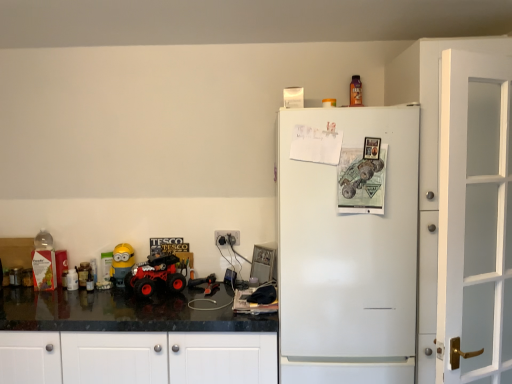
Question: From a real-world perspective, is rubberized red monster truck at lower left physically located above or below white glass door at right?

Choices:
 (A) above
 (B) below

Answer: (B)

Question: In terms of height, does rubberized red monster truck at lower left look taller or shorter compared to white glass door at right?

Choices:
 (A) tall
 (B) short

Answer: (B)

Question: Estimate the real-world distances between objects in this image. Which object is closer to the yellow matte minion at left, arranged as the 2th toy when viewed from the right?

Choices:
 (A) white plastic electric outlet at center
 (B) rubberized red monster truck at lower left
 (C) white matte refrigerator at right
 (D) metallic orange bottle at upper center, which is the 3th toy in bottom-to-top order
 (E) black granite countertop at lower left

Answer: (B)

Question: Which object is positioned farthest from the white plastic electric outlet at center?

Choices:
 (A) white glass door at right
 (B) white matte refrigerator at right
 (C) metallic orange bottle at upper center, placed as the first toy when sorted from top to bottom
 (D) translucent plastic bottle at left, marked as the 2th toy in a top-to-bottom arrangement
 (E) rubberized red monster truck at lower left

Answer: (A)